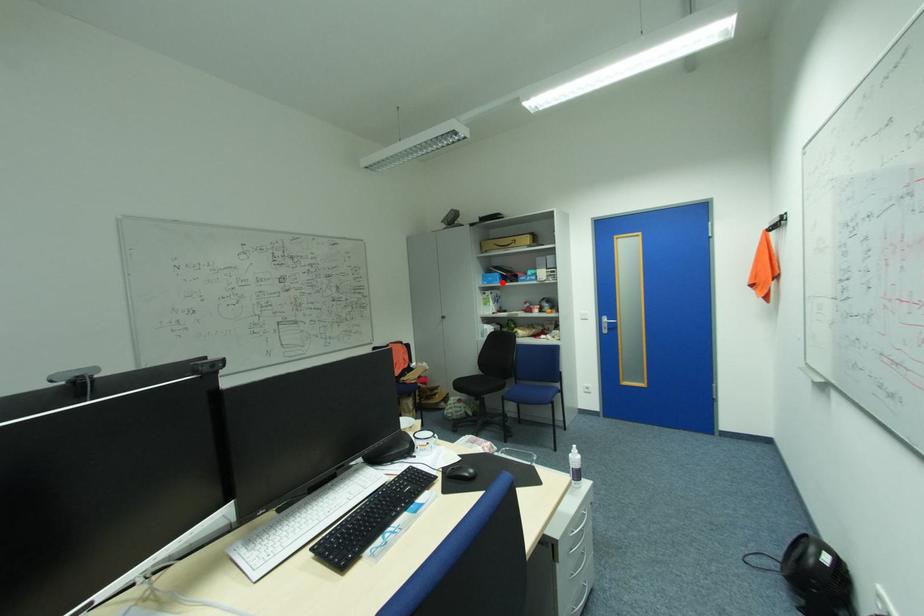
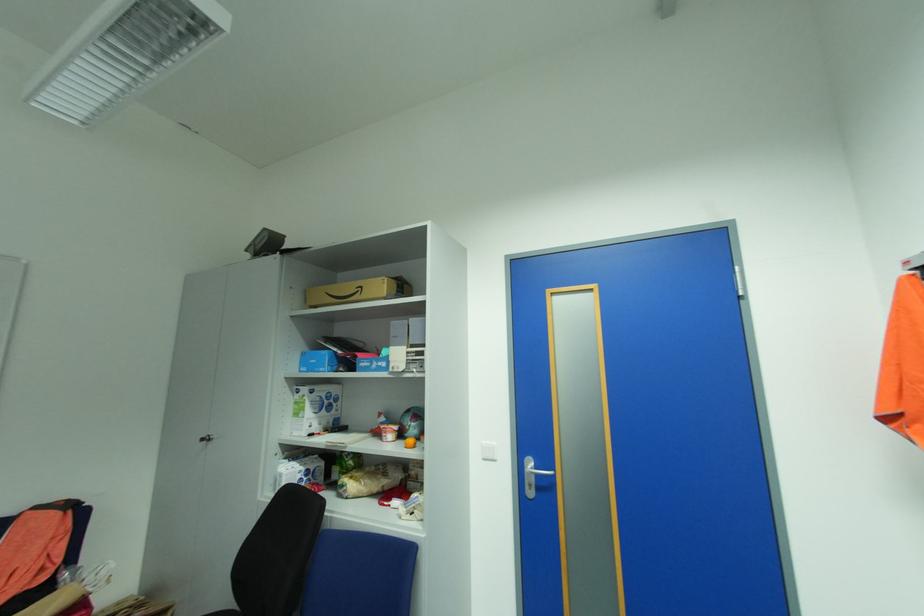
Question: I am providing you with two images of the same scene from different viewpoints. A red point is shown in image1. For the corresponding object point in image2, is it positioned nearer or farther from the camera?

Choices:
 (A) Nearer
 (B) Farther

Answer: (B)